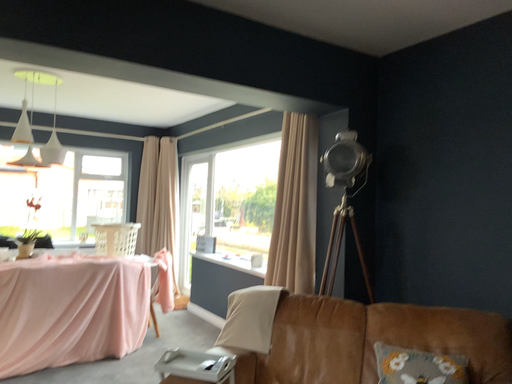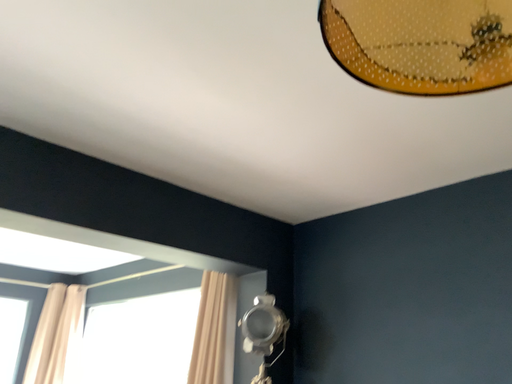
Question: How did the camera likely rotate when shooting the video?

Choices:
 (A) rotated right
 (B) rotated left

Answer: (A)